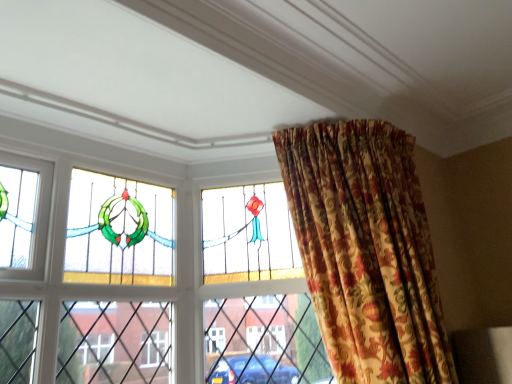
This screenshot has height=384, width=512. In order to click on floral fabric curtain at upper right in this screenshot , I will do `click(366, 250)`.

What do you see at coordinates (366, 250) in the screenshot?
I see `floral fabric curtain at upper right` at bounding box center [366, 250].

Where is `floral fabric curtain at upper right`? floral fabric curtain at upper right is located at coordinates (366, 250).